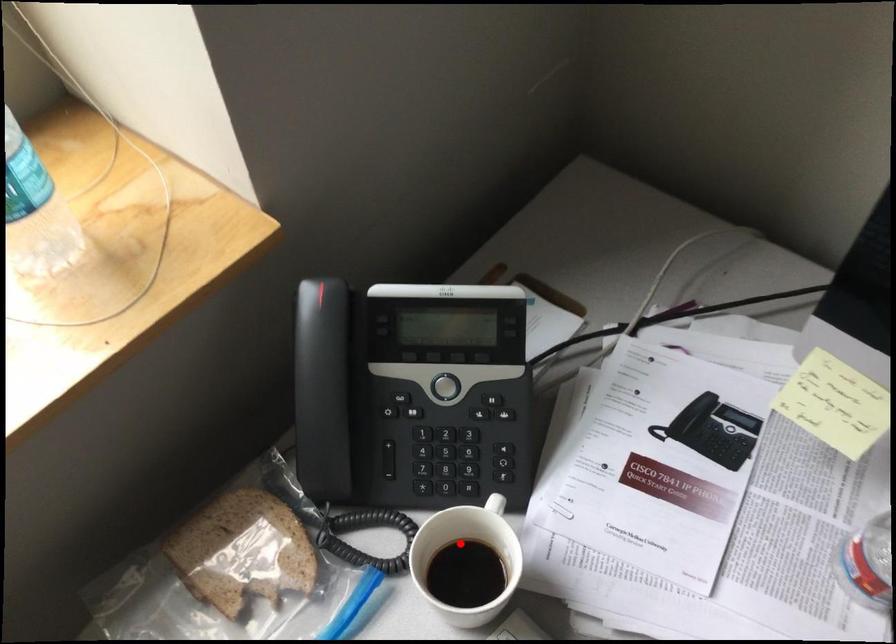
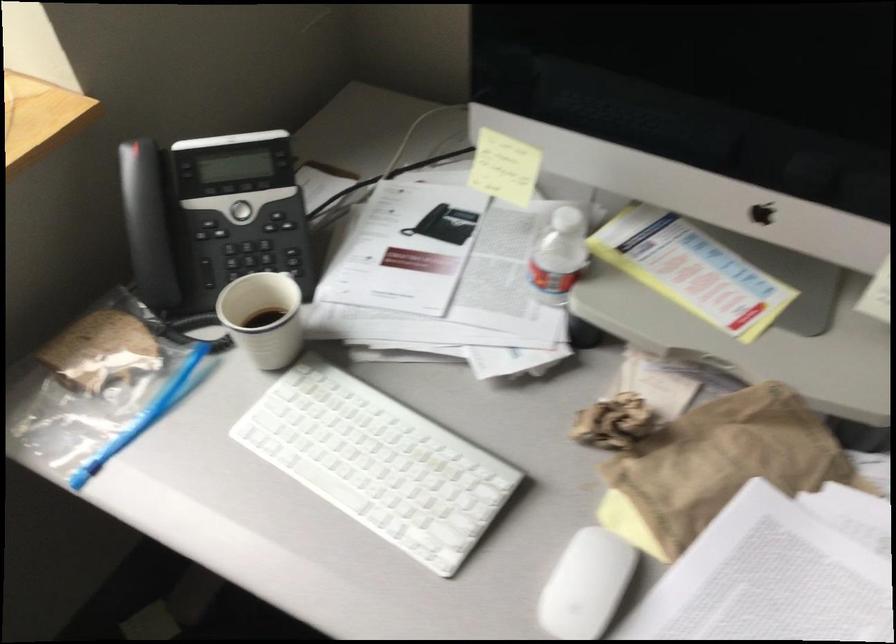
Question: A red point is marked in image1. In image2, is the corresponding 3D point closer to the camera or farther? Reply with the corresponding letter.

Choices:
 (A) The corresponding 3D point is closer.
 (B) The corresponding 3D point is farther.

Answer: (B)